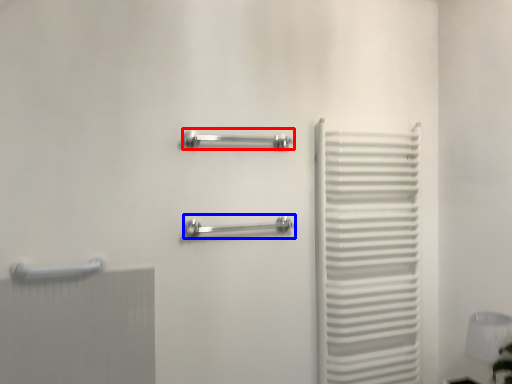
Question: Which point is further to the camera, towel rack (highlighted by a red box) or towel rack (highlighted by a blue box)?

Choices:
 (A) towel rack
 (B) towel rack

Answer: (A)